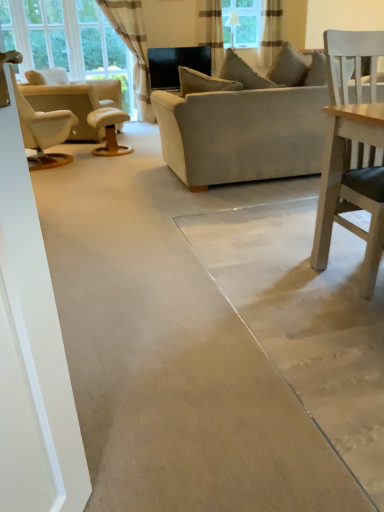
What do you see at coordinates (270, 31) in the screenshot? I see `striped fabric curtain at upper center, marked as the 3th curtain in a left-to-right arrangement` at bounding box center [270, 31].

Locate an element on the screen. white leather recliner at left is located at coordinates (70, 106).

The width and height of the screenshot is (384, 512). I want to click on white striped curtain at upper left, placed as the third curtain when sorted from right to left, so click(x=133, y=48).

This screenshot has height=512, width=384. What do you see at coordinates (211, 31) in the screenshot? I see `striped fabric curtain at upper center, the 2th curtain from the right` at bounding box center [211, 31].

In order to face suede gray couch at center, should I rotate leftwards or rightwards?

To align with it, rotate right about 9.787°.

What is the approximate height of suede gray couch at center?

1.04 meters.

Find the location of `striped fabric curtain at upper center, marked as the 3th curtain in a left-to-right arrangement`. striped fabric curtain at upper center, marked as the 3th curtain in a left-to-right arrangement is located at coordinates (270, 31).

Is striped fabric curtain at upper center, marked as the 3th curtain in a left-to-right arrangement, to the right of suede gray couch at center from the viewer's perspective?

Correct, you'll find striped fabric curtain at upper center, marked as the 3th curtain in a left-to-right arrangement, to the right of suede gray couch at center.

Is striped fabric curtain at upper center, marked as the first curtain in a right-to-left arrangement, directly adjacent to suede gray couch at center?

striped fabric curtain at upper center, marked as the first curtain in a right-to-left arrangement, and suede gray couch at center are clearly separated.

Is striped fabric curtain at upper center, marked as the 3th curtain in a left-to-right arrangement, in front of or behind suede gray couch at center in the image?

In the image, striped fabric curtain at upper center, marked as the 3th curtain in a left-to-right arrangement, appears behind suede gray couch at center.

Considering the relative sizes of striped fabric curtain at upper center, marked as the 3th curtain in a left-to-right arrangement, and suede gray couch at center in the image provided, is striped fabric curtain at upper center, marked as the 3th curtain in a left-to-right arrangement, taller than suede gray couch at center?

Incorrect, the height of striped fabric curtain at upper center, marked as the 3th curtain in a left-to-right arrangement, is not larger of that of suede gray couch at center.

Can you confirm if striped fabric curtain at upper center, marked as the 3th curtain in a left-to-right arrangement, is smaller than striped fabric curtain at upper center, which is the second curtain from left to right?

Yes.

Considering the relative positions of striped fabric curtain at upper center, marked as the first curtain in a right-to-left arrangement, and striped fabric curtain at upper center, the 2th curtain from the right, in the image provided, is striped fabric curtain at upper center, marked as the first curtain in a right-to-left arrangement, behind striped fabric curtain at upper center, the 2th curtain from the right,?

Yes, it is.

Is striped fabric curtain at upper center, marked as the first curtain in a right-to-left arrangement, not inside striped fabric curtain at upper center, which is the second curtain from left to right?

Yes, striped fabric curtain at upper center, marked as the first curtain in a right-to-left arrangement, is located beyond the bounds of striped fabric curtain at upper center, which is the second curtain from left to right.

Is striped fabric curtain at upper center, marked as the 3th curtain in a left-to-right arrangement, wider than striped fabric curtain at upper center, the 2th curtain from the right?

In fact, striped fabric curtain at upper center, marked as the 3th curtain in a left-to-right arrangement, might be narrower than striped fabric curtain at upper center, the 2th curtain from the right.

Could you measure the distance between white leather recliner at left and white striped curtain at upper left, placed as the third curtain when sorted from right to left?

white leather recliner at left and white striped curtain at upper left, placed as the third curtain when sorted from right to left, are 1.52 meters apart from each other.

In the scene shown: From the image's perspective, is white leather recliner at left located above white striped curtain at upper left, placed as the third curtain when sorted from right to left?

No, from the image's perspective, white leather recliner at left is not on top of white striped curtain at upper left, placed as the third curtain when sorted from right to left.

Does white leather recliner at left have a lesser height compared to white striped curtain at upper left, placed as the third curtain when sorted from right to left?

Correct, white leather recliner at left is not as tall as white striped curtain at upper left, placed as the third curtain when sorted from right to left.

Does white striped curtain at upper left, placed as the third curtain when sorted from right to left, turn towards striped fabric curtain at upper center, which is the second curtain from left to right?

No.

Between white striped curtain at upper left, placed as the first curtain when sorted from left to right, and striped fabric curtain at upper center, the 2th curtain from the right, which one has more height?

white striped curtain at upper left, placed as the first curtain when sorted from left to right.

From a real-world perspective, is white striped curtain at upper left, placed as the first curtain when sorted from left to right, positioned over striped fabric curtain at upper center, the 2th curtain from the right, based on gravity?

Incorrect, from a real-world perspective, white striped curtain at upper left, placed as the first curtain when sorted from left to right, is lower than striped fabric curtain at upper center, the 2th curtain from the right.

Considering the positions of objects wooden stool at center and striped fabric curtain at upper center, marked as the first curtain in a right-to-left arrangement, in the image provided, who is more to the right, wooden stool at center or striped fabric curtain at upper center, marked as the first curtain in a right-to-left arrangement,?

striped fabric curtain at upper center, marked as the first curtain in a right-to-left arrangement, is more to the right.

Does wooden stool at center lie in front of striped fabric curtain at upper center, marked as the 3th curtain in a left-to-right arrangement?

Yes, the depth of wooden stool at center is less than that of striped fabric curtain at upper center, marked as the 3th curtain in a left-to-right arrangement.

From a real-world perspective, does wooden stool at center sit lower than striped fabric curtain at upper center, marked as the first curtain in a right-to-left arrangement?

Correct, in the physical world, wooden stool at center is lower than striped fabric curtain at upper center, marked as the first curtain in a right-to-left arrangement.

Which object is wider, wooden stool at center or striped fabric curtain at upper center, marked as the 3th curtain in a left-to-right arrangement?

wooden stool at center.

Is point (273, 125) behind point (113, 150)?

No, (273, 125) is in front of (113, 150).

Relative to wooden stool at center, is suede gray couch at center in front or behind?

Visually, suede gray couch at center is located in front of wooden stool at center.

Is suede gray couch at center not inside wooden stool at center?

suede gray couch at center lies outside wooden stool at center's area.

Is suede gray couch at center far away from wooden stool at center?

Yes, suede gray couch at center and wooden stool at center are quite far apart.

Where is `table in front of the striped fabric curtain at upper center, the 2th curtain from the right`? table in front of the striped fabric curtain at upper center, the 2th curtain from the right is located at coordinates (109, 130).

Which object is closer to the camera, wooden stool at center or striped fabric curtain at upper center, the 2th curtain from the right?

wooden stool at center.

Is wooden stool at center wider or thinner than striped fabric curtain at upper center, which is the second curtain from left to right?

wooden stool at center is wider than striped fabric curtain at upper center, which is the second curtain from left to right.

From the image's perspective, starting from the suede gray couch at center, which curtain is the 3rd one above? Please provide its 2D coordinates.

[(270, 31)]

Where is `curtain behind the striped fabric curtain at upper center, the 2th curtain from the right`? The image size is (384, 512). curtain behind the striped fabric curtain at upper center, the 2th curtain from the right is located at coordinates (270, 31).

In the scene shown: From the image, which object appears to be farther from wooden stool at center, suede gray couch at center or white striped curtain at upper left, placed as the third curtain when sorted from right to left?

Based on the image, white striped curtain at upper left, placed as the third curtain when sorted from right to left, appears to be further to wooden stool at center.

Looking at the image, which one is located closer to striped fabric curtain at upper center, marked as the first curtain in a right-to-left arrangement, striped fabric curtain at upper center, which is the second curtain from left to right, or white striped curtain at upper left, placed as the first curtain when sorted from left to right?

Based on the image, striped fabric curtain at upper center, which is the second curtain from left to right, appears to be nearer to striped fabric curtain at upper center, marked as the first curtain in a right-to-left arrangement.

When comparing their distances from white leather recliner at left, does white striped curtain at upper left, placed as the first curtain when sorted from left to right, or wooden stool at center seem further?

Based on the image, white striped curtain at upper left, placed as the first curtain when sorted from left to right, appears to be further to white leather recliner at left.

Looking at the image, which one is located further to white striped curtain at upper left, placed as the first curtain when sorted from left to right, suede gray couch at center or striped fabric curtain at upper center, which is the second curtain from left to right?

suede gray couch at center is further to white striped curtain at upper left, placed as the first curtain when sorted from left to right.

When comparing their distances from suede gray couch at center, does white leather recliner at left or wooden stool at center seem further?

Based on the image, white leather recliner at left appears to be further to suede gray couch at center.

Estimate the real-world distances between objects in this image. Which object is closer to white leather recliner at left, striped fabric curtain at upper center, marked as the 3th curtain in a left-to-right arrangement, or white striped curtain at upper left, placed as the third curtain when sorted from right to left?

white striped curtain at upper left, placed as the third curtain when sorted from right to left, lies closer to white leather recliner at left than the other object.

Estimate the real-world distances between objects in this image. Which object is closer to wooden stool at center, white leather recliner at left or white striped curtain at upper left, placed as the first curtain when sorted from left to right?

white leather recliner at left is closer to wooden stool at center.

From the image, which object appears to be farther from wooden stool at center, striped fabric curtain at upper center, marked as the 3th curtain in a left-to-right arrangement, or striped fabric curtain at upper center, which is the second curtain from left to right?

The object further to wooden stool at center is striped fabric curtain at upper center, marked as the 3th curtain in a left-to-right arrangement.

Find the location of a particular element. The height and width of the screenshot is (512, 384). chair that lies between striped fabric curtain at upper center, which is the second curtain from left to right, and wooden stool at center from top to bottom is located at coordinates (70, 106).

Locate an element on the screen. table located between white leather recliner at left and striped fabric curtain at upper center, marked as the 3th curtain in a left-to-right arrangement, in the left-right direction is located at coordinates (109, 130).

You are a GUI agent. You are given a task and a screenshot of the screen. Output one action in this format:
    pyautogui.click(x=<x>, y=<y>)
    Task: Click on the table between suede gray couch at center and striped fabric curtain at upper center, the 2th curtain from the right, from front to back
    The width and height of the screenshot is (384, 512).
    Given the screenshot: What is the action you would take?
    pyautogui.click(x=109, y=130)

Image resolution: width=384 pixels, height=512 pixels. In order to click on curtain that lies between striped fabric curtain at upper center, which is the second curtain from left to right, and wooden stool at center from top to bottom in this screenshot , I will do `click(133, 48)`.